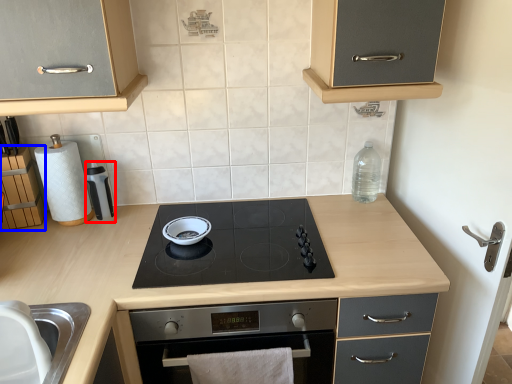
Question: Which object appears closest to the camera in this image, appliance (highlighted by a red box) or cabinetry (highlighted by a blue box)?

Choices:
 (A) appliance
 (B) cabinetry

Answer: (B)